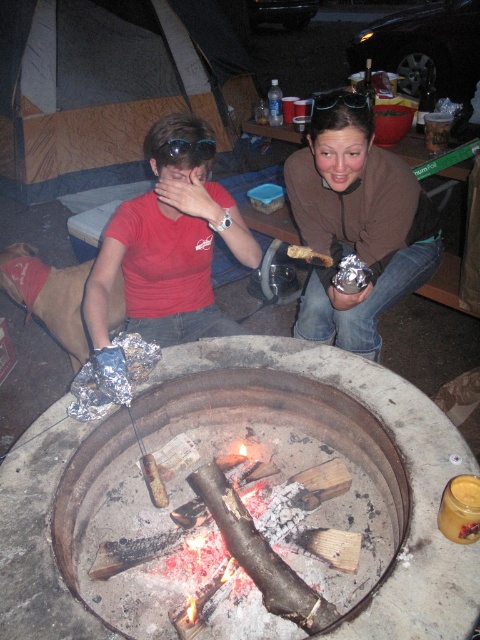
You are a hiker who has just arrived at the campsite and wants to put on a warm sweater. The sweater is located at point (358, 227). Can you reach the sweater from your current position at the fire pit without moving more than 2 meters?

The sweater is located at point (358, 227). Since the distance between the fire pit and the sweater is not specified, it is impossible to determine if you can reach it without moving more than 2 meters.

You are packing for a camping trip and need to decide whether the matte brown sweater at center can fit into your backpack compartment that currently holds the black plastic goggles at upper center. Based on their sizes, will the sweater fit?

The matte brown sweater at center is larger than the black plastic goggles at upper center, so it may not fit into the backpack compartment that already holds the goggles unless there is additional space.